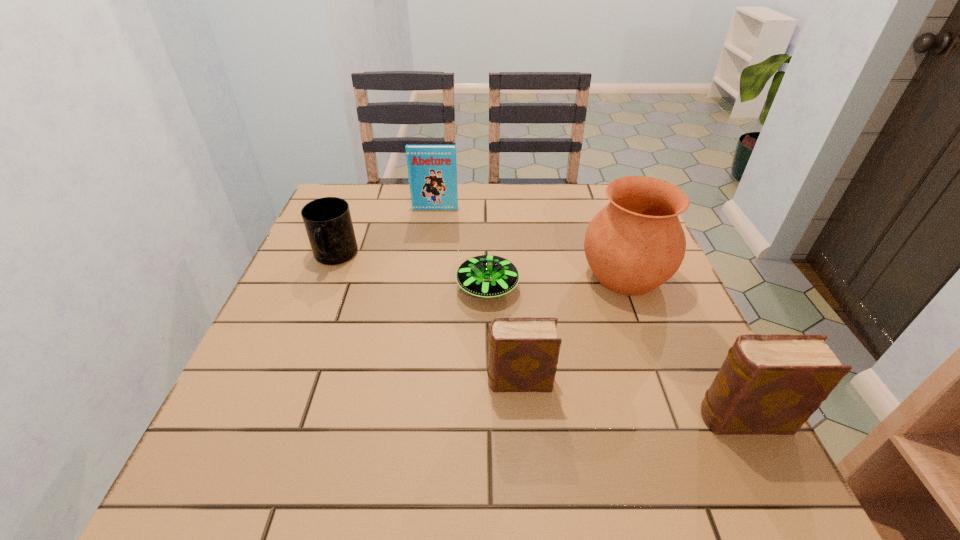
I want to click on free point that keeps the diarys evenly spaced on the left, so click(x=324, y=349).